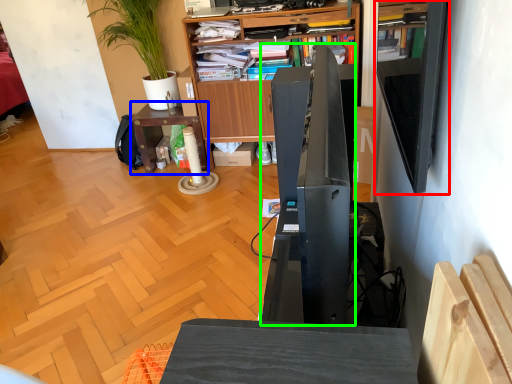
Question: Estimate the real-world distances between objects in this image. Which object is closer to shelf (highlighted by a red box), table (highlighted by a blue box) or appliance (highlighted by a green box)?

Choices:
 (A) table
 (B) appliance

Answer: (B)